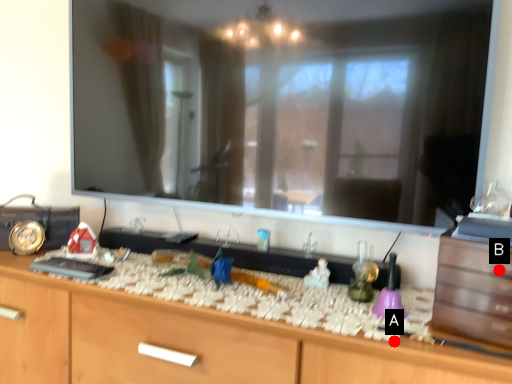
Question: Two points are circled on the image, labeled by A and B beside each circle. Which point is further to the camera?

Choices:
 (A) A is further
 (B) B is further

Answer: (B)